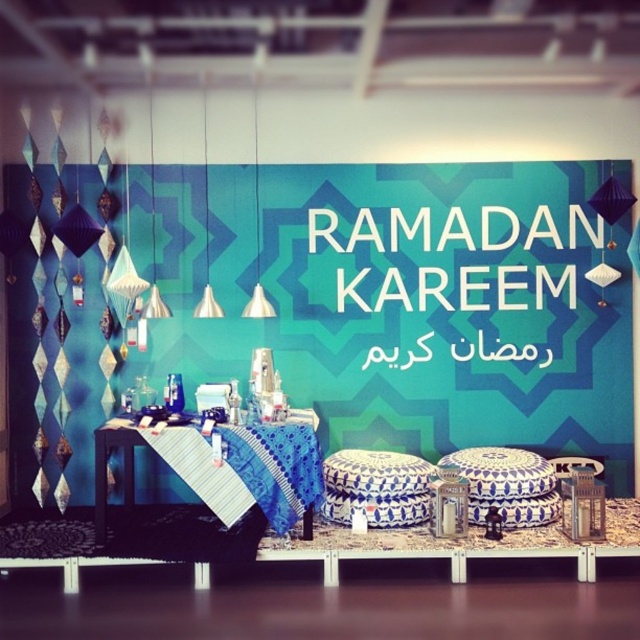
You are standing in front of the festive Ramadan Kareem setup. There is a point at coordinates (172, 468). What object is located at this point?

The point at coordinates (172, 468) corresponds to the blue fabric table at center.

You are planning to place a decorative tray that requires 2 feet of space on the table. Considering the blue fabric table at center and the blue and white ceramic stool at center, which surface can accommodate the tray?

The blue fabric table at center can accommodate the tray because its width is larger than the blue and white ceramic stool at center, providing enough space for the 2 feet requirement.

You are standing in front of the table with the blue and white striped tablecloth. There are two points marked on the table surface. One is at coordinate point (177, 444) and the other at point (164, 396). Which point is closer to you?

Point (177, 444) is closer to the viewer than point (164, 396).